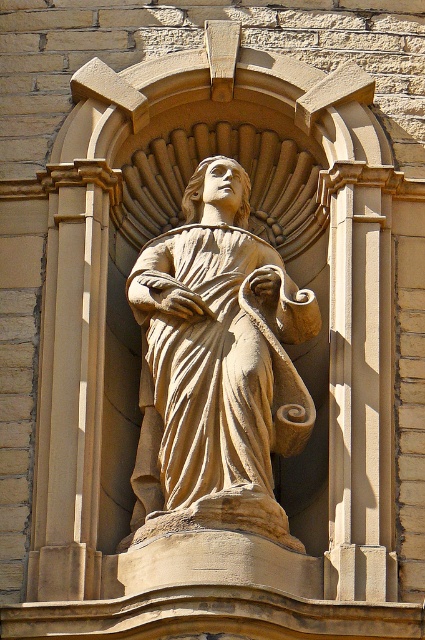
Question: Which point is closer to the camera?

Choices:
 (A) (300, 392)
 (B) (59, 221)

Answer: (A)

Question: Considering the relative positions of beige stone statue at center and beige stone column at left in the image provided, where is beige stone statue at center located with respect to beige stone column at left?

Choices:
 (A) left
 (B) right

Answer: (B)

Question: Where is beige stone statue at center located in relation to beige stone column at left in the image?

Choices:
 (A) below
 (B) above

Answer: (B)

Question: Can you confirm if beige stone statue at center is thinner than beige stone column at left?

Choices:
 (A) no
 (B) yes

Answer: (A)